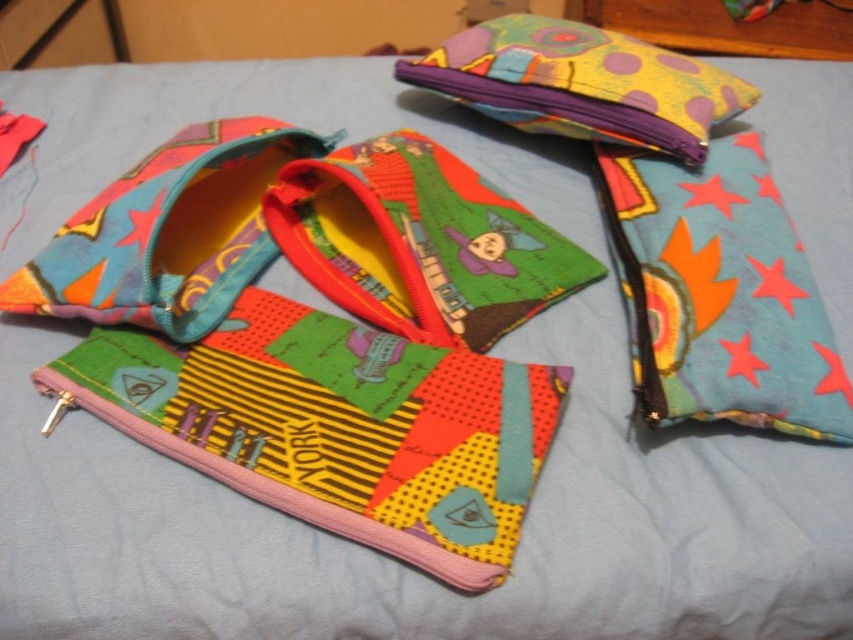
You are organizing a display of fabric pouches on a light blue surface. You need to place a teal fabric pouch at right in such a way that it doesn not overlap with any other pouches. Given that the coordinate system starts at the bottom left corner of the image, can you confirm if placing it at point 0.459, 0.844 is feasible?

The teal fabric pouch at right is located at point (718, 292), which means it is already placed at that coordinate without overlapping with other pouches as per the provided information.

You are organizing the fabric pouches and need to move the teal fabric pouch at right. Which direction should you move it to avoid covering the multicolored fabric pouch at upper center?

The teal fabric pouch at right is currently in front of the multicolored fabric pouch at upper center. To avoid covering it, you should move the teal fabric pouch at right away from the direction of the multicolored fabric pouch at upper center, either to the side or backward.

You are organizing a craft fair booth and need to arrange these two pouches on a shelf. The teal fabric pouch at right is taller than the multicolored fabric pouch at upper center. To ensure stability, you want to place the taller pouch behind the shorter one. Which pouch should be placed in the back?

The teal fabric pouch at right should be placed in the back because it is taller than the multicolored fabric pouch at upper center, allowing it to be positioned behind for stability.